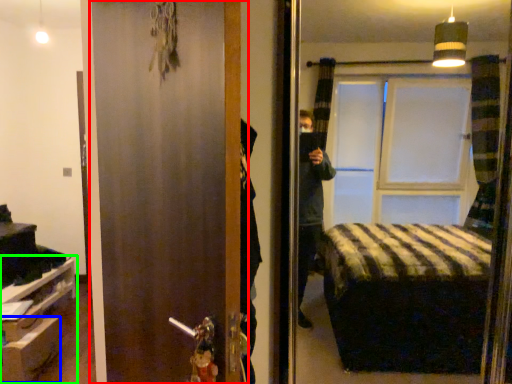
Question: Based on their relative distances, which object is nearer to door (highlighted by a red box)? Choose from drawer (highlighted by a blue box) and furniture (highlighted by a green box).

Choices:
 (A) drawer
 (B) furniture

Answer: (A)